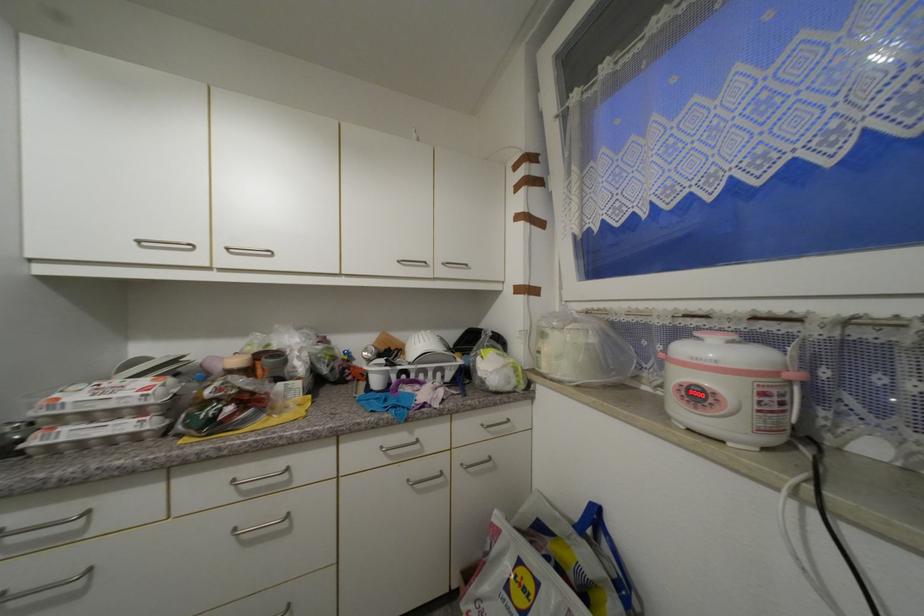
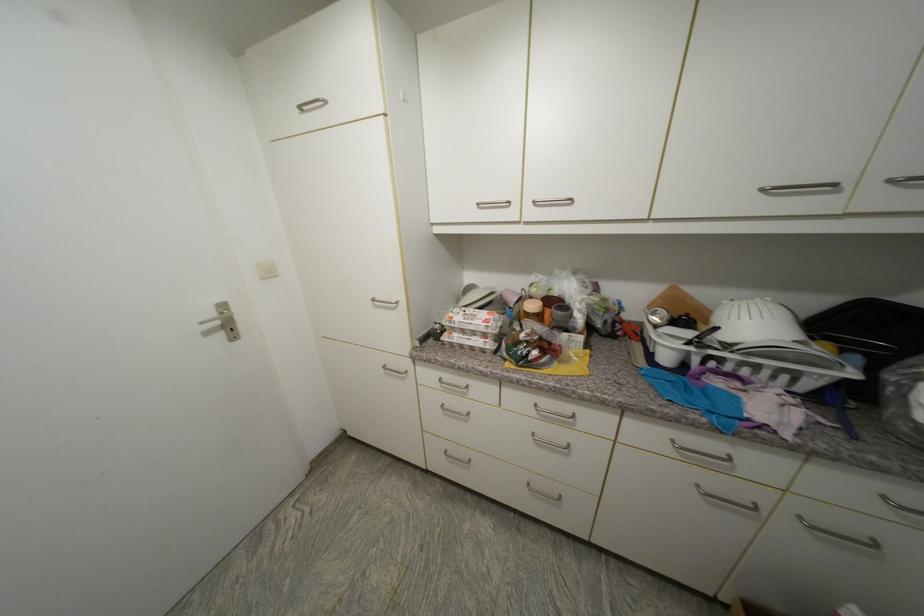
The point at (x=393, y=336) is marked in the first image. Where is the corresponding point in the second image?

(685, 292)